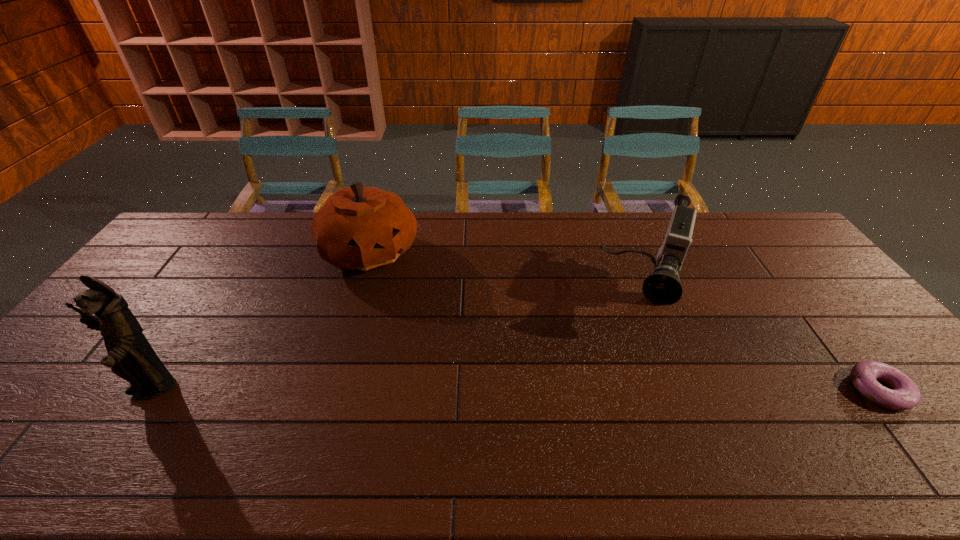
Identify the location of free space at the left edge of the desktop. The height and width of the screenshot is (540, 960). (185, 276).

Where is `vacant space at the far right corner of the desktop`? The height and width of the screenshot is (540, 960). vacant space at the far right corner of the desktop is located at coordinates (756, 237).

What are the coordinates of `blank region between the camcorder and the pumpkin` in the screenshot? It's located at (508, 275).

I want to click on vacant space that is in between the second object from right to left and the rightmost object, so click(x=762, y=345).

Find the location of a particular element. Image resolution: width=960 pixels, height=540 pixels. vacant space in between the second object from left to right and the figurine is located at coordinates click(261, 321).

Where is `unoccupied area between the second object from left to right and the figurine`? This screenshot has width=960, height=540. unoccupied area between the second object from left to right and the figurine is located at coordinates (261, 321).

The image size is (960, 540). I want to click on empty space that is in between the shortest object and the second object from right to left, so click(x=762, y=345).

Find the location of `vacant space in between the doughnut and the camcorder`. vacant space in between the doughnut and the camcorder is located at coordinates pos(762,345).

Where is `vacant space that is in between the third object from left to right and the pumpkin`? This screenshot has width=960, height=540. vacant space that is in between the third object from left to right and the pumpkin is located at coordinates (508, 275).

Locate an element on the screen. The image size is (960, 540). unoccupied position between the tallest object and the pumpkin is located at coordinates (261, 321).